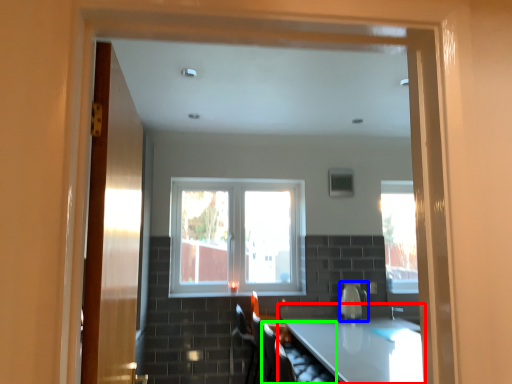
Question: Based on their relative distances, which object is farther from countertop (highlighted by a red box)? Choose from appliance (highlighted by a blue box) and armchair (highlighted by a green box).

Choices:
 (A) appliance
 (B) armchair

Answer: (A)